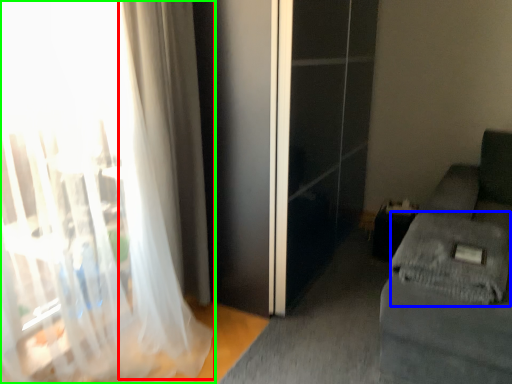
Question: Estimate the real-world distances between objects in this image. Which object is closer to curtain (highlighted by a red box), sheet (highlighted by a blue box) or curtain (highlighted by a green box)?

Choices:
 (A) sheet
 (B) curtain

Answer: (B)